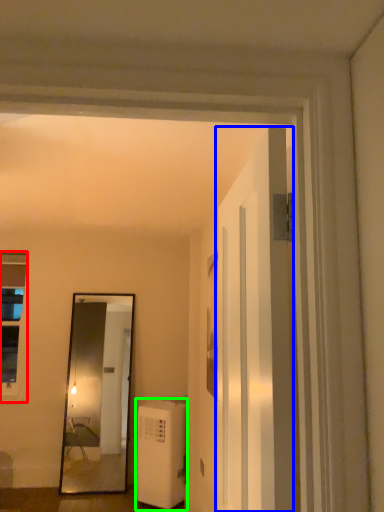
Question: Which is farther away from window (highlighted by a red box)? door (highlighted by a blue box) or air conditioner (highlighted by a green box)?

Choices:
 (A) door
 (B) air conditioner

Answer: (A)